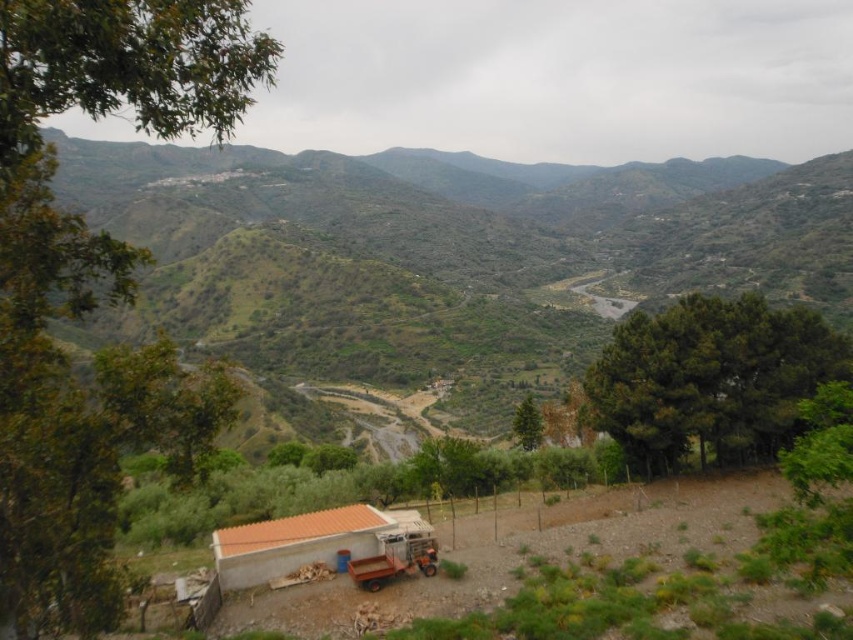
This screenshot has width=853, height=640. What do you see at coordinates (583, 576) in the screenshot? I see `brown gravel dirt track at lower center` at bounding box center [583, 576].

Is point (601, 508) behind point (282, 538)?

That is True.

Where is `brown gravel dirt track at lower center`? brown gravel dirt track at lower center is located at coordinates (583, 576).